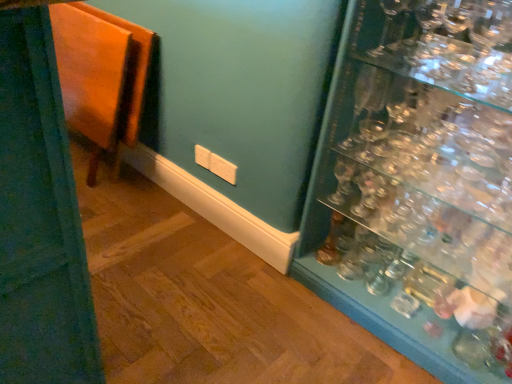
Question: Is transparent glass shelves at right located outside clear glass wine glass at upper right?

Choices:
 (A) no
 (B) yes

Answer: (B)

Question: Is clear glass wine glass at upper right inside transparent glass shelves at right?

Choices:
 (A) yes
 (B) no

Answer: (A)

Question: Is transparent glass shelves at right closer to camera compared to clear glass wine glass at upper right?

Choices:
 (A) no
 (B) yes

Answer: (B)

Question: From a real-world perspective, is transparent glass shelves at right below clear glass wine glass at upper right?

Choices:
 (A) yes
 (B) no

Answer: (A)

Question: Is transparent glass shelves at right facing away from clear glass wine glass at upper right?

Choices:
 (A) no
 (B) yes

Answer: (A)

Question: From a real-world perspective, relative to transparent glass shelves at right, is wooden folding table at left vertically above or below?

Choices:
 (A) below
 (B) above

Answer: (A)

Question: Is point (134, 69) positioned closer to the camera than point (376, 201)?

Choices:
 (A) farther
 (B) closer

Answer: (A)

Question: Considering the positions of wooden folding table at left and transparent glass shelves at right in the image, is wooden folding table at left wider or thinner than transparent glass shelves at right?

Choices:
 (A) wide
 (B) thin

Answer: (B)

Question: From the image's perspective, is wooden folding table at left positioned above or below transparent glass shelves at right?

Choices:
 (A) above
 (B) below

Answer: (A)

Question: In terms of width, does clear glass wine glass at upper right look wider or thinner when compared to wooden folding table at left?

Choices:
 (A) thin
 (B) wide

Answer: (A)

Question: From the image's perspective, is clear glass wine glass at upper right located above or below wooden folding table at left?

Choices:
 (A) below
 (B) above

Answer: (B)

Question: Relative to wooden folding table at left, is clear glass wine glass at upper right in front or behind?

Choices:
 (A) behind
 (B) front

Answer: (B)

Question: In the image, is clear glass wine glass at upper right on the left side or the right side of wooden folding table at left?

Choices:
 (A) left
 (B) right

Answer: (B)

Question: From a real-world perspective, is transparent glass shelves at right above or below clear glass wine glass at upper right?

Choices:
 (A) below
 (B) above

Answer: (A)

Question: In the image, is transparent glass shelves at right positioned in front of or behind clear glass wine glass at upper right?

Choices:
 (A) front
 (B) behind

Answer: (A)